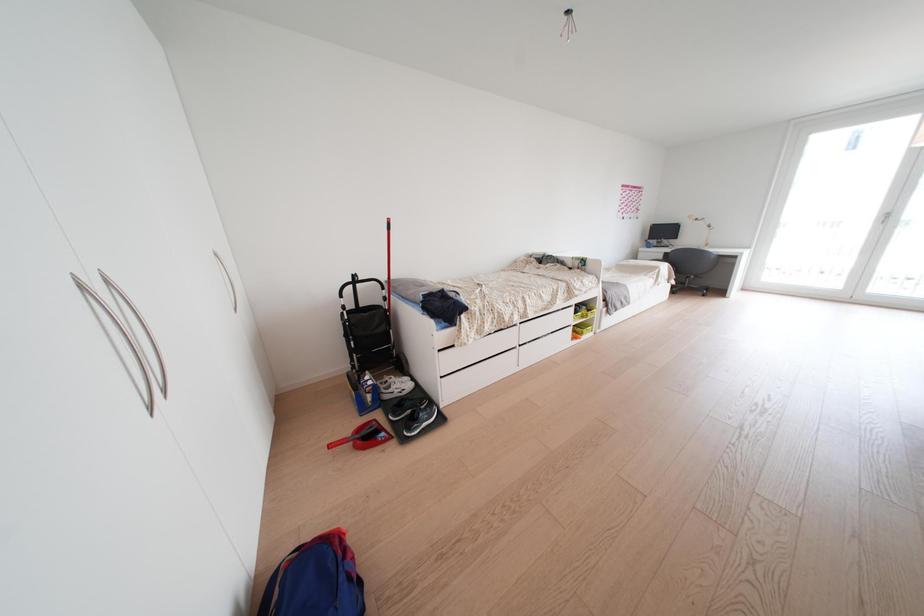
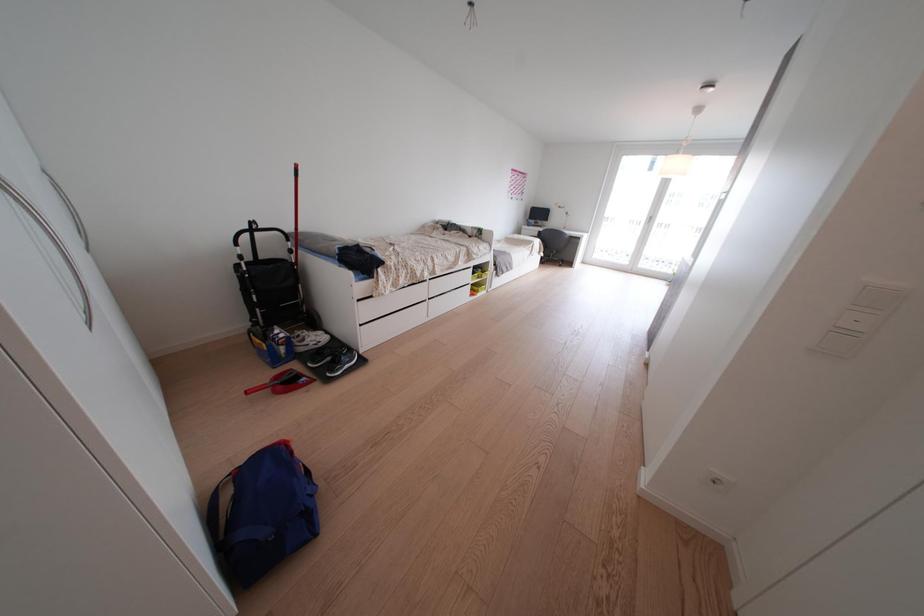
What movement of the cameraman would produce the second image?

The movement direction of the cameraman is left, backward.